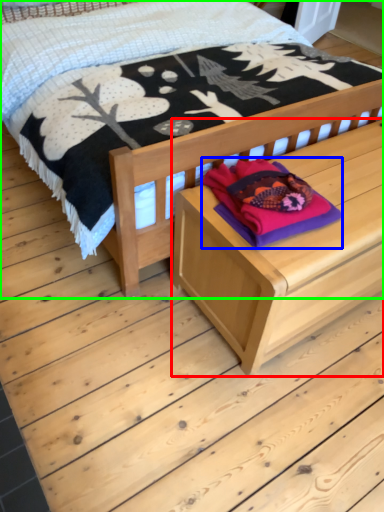
Question: Which is farther away from table (highlighted by a red box)? clothing (highlighted by a blue box) or bed (highlighted by a green box)?

Choices:
 (A) clothing
 (B) bed

Answer: (B)